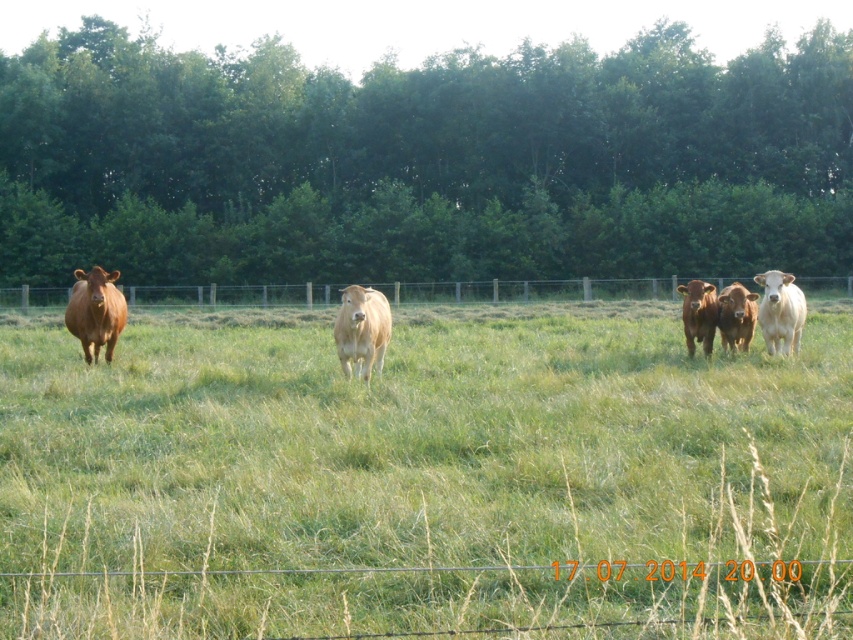
Who is more forward, (173, 344) or (825, 276)?

Point (173, 344) is in front.

Which is above, green grassy field at center or metal wire fence at center?

Positioned higher is metal wire fence at center.

The width and height of the screenshot is (853, 640). Find the location of `green grassy field at center`. green grassy field at center is located at coordinates (424, 481).

Between light brown cow at center and white smooth cow at center, which one appears on the left side from the viewer's perspective?

light brown cow at center is more to the left.

Does point (374, 358) lie in front of point (772, 291)?

That is True.

Which is in front, point (352, 284) or point (802, 292)?

Positioned in front is point (802, 292).

Image resolution: width=853 pixels, height=640 pixels. What are the coordinates of `light brown cow at center` in the screenshot? It's located at (361, 330).

Is green grassy field at center behind white smooth cow at center?

No, it is in front of white smooth cow at center.

Which is above, green grassy field at center or white smooth cow at center?

white smooth cow at center is higher up.

Does point (701, 404) lie behind point (775, 333)?

No, (701, 404) is in front of (775, 333).

Where is `green grassy field at center`? The image size is (853, 640). green grassy field at center is located at coordinates (424, 481).